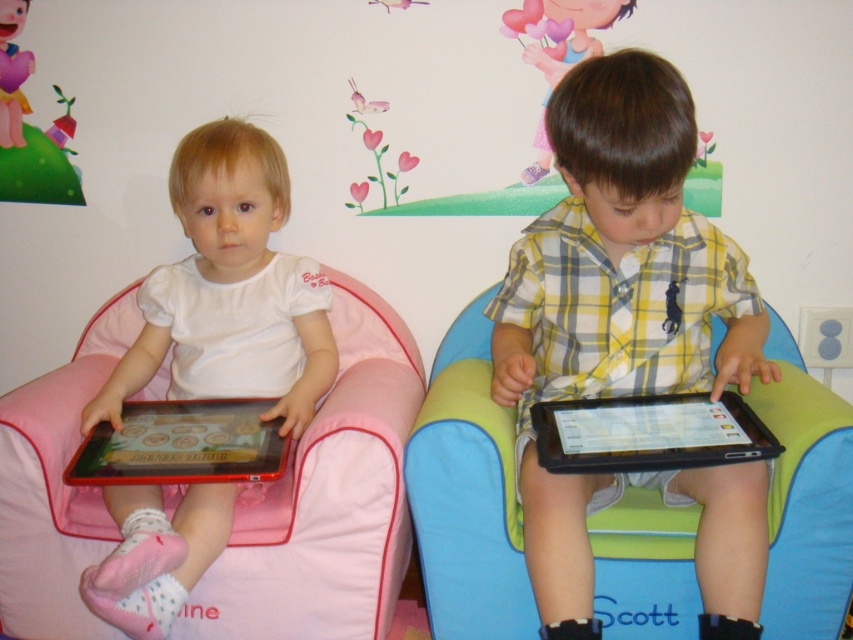
You are a parent trying to decide which decoration to place closer to your children for their birthday party. The decorations are the pastel heart balloons at upper center and the matte pink heart at upper left. Based on their sizes, which one would you choose to be nearer to the children so it appears the same size as the other decoration from where they are sitting?

The pastel heart balloons at upper center has a larger size compared to matte pink heart at upper left. To make them appear the same size from the childrens sitting position, you should place the smaller matte pink heart at upper left closer to them and the larger pastel heart balloons at upper center farther away.

You are taking a photo of the two points in the image. Which point, point (647, 442) or point (143, 440), will appear larger in your photo?

Point (647, 442) will appear larger in the photo because it is closer to the camera than point (143, 440).